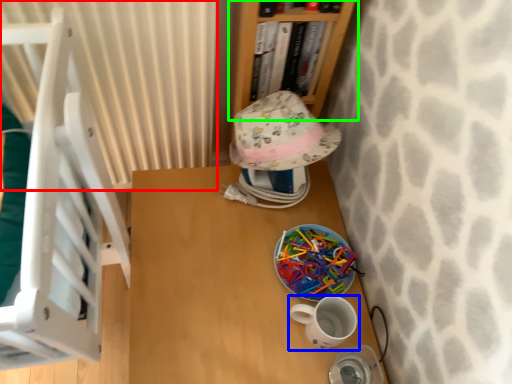
Question: Which object is the farthest from curtain (highlighted by a red box)? Choose among these: coffee cup (highlighted by a blue box) or bookcase (highlighted by a green box).

Choices:
 (A) coffee cup
 (B) bookcase

Answer: (A)